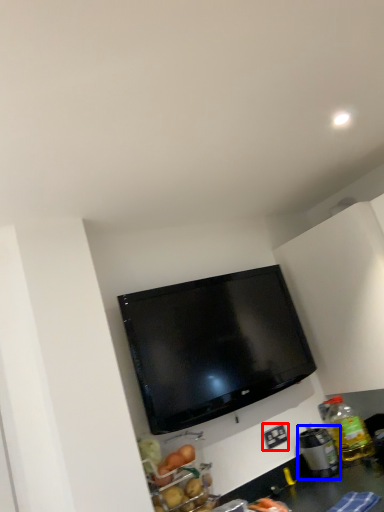
Question: Which object appears farthest to the camera in this image, electric outlet (highlighted by a red box) or appliance (highlighted by a blue box)?

Choices:
 (A) electric outlet
 (B) appliance

Answer: (A)